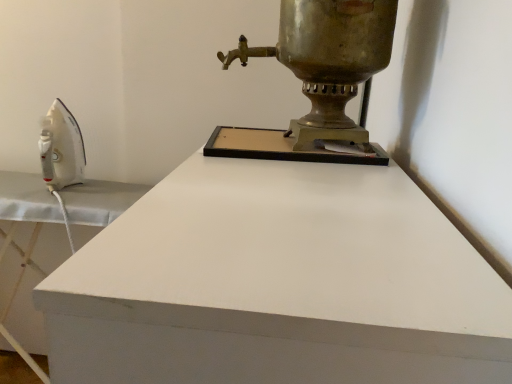
Question: In terms of width, does shiny brass samovar at upper right look wider or thinner when compared to white glossy ironing board at left?

Choices:
 (A) thin
 (B) wide

Answer: (A)

Question: Is point (283, 142) closer or farther from the camera than point (245, 211)?

Choices:
 (A) closer
 (B) farther

Answer: (B)

Question: From a real-world perspective, relative to white glossy ironing board at left, is shiny brass samovar at upper right vertically above or below?

Choices:
 (A) below
 (B) above

Answer: (B)

Question: Do you think white glossy ironing board at left is within shiny brass samovar at upper right, or outside of it?

Choices:
 (A) inside
 (B) outside

Answer: (B)

Question: Is white glossy ironing board at left wider or thinner than shiny brass samovar at upper right?

Choices:
 (A) thin
 (B) wide

Answer: (B)

Question: Looking at the image, does white glossy ironing board at left seem bigger or smaller compared to shiny brass samovar at upper right?

Choices:
 (A) big
 (B) small

Answer: (A)

Question: From their relative heights in the image, would you say white glossy ironing board at left is taller or shorter than shiny brass samovar at upper right?

Choices:
 (A) short
 (B) tall

Answer: (B)